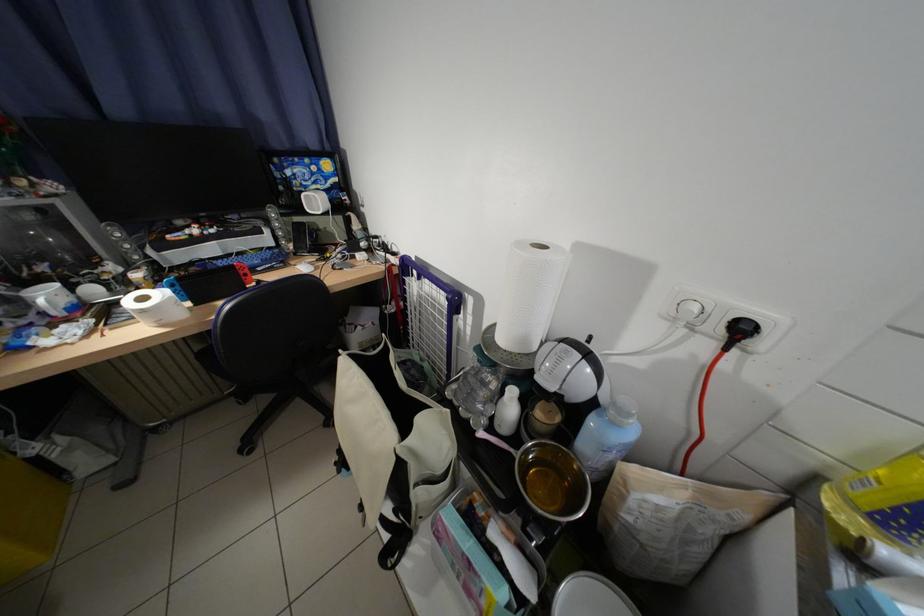
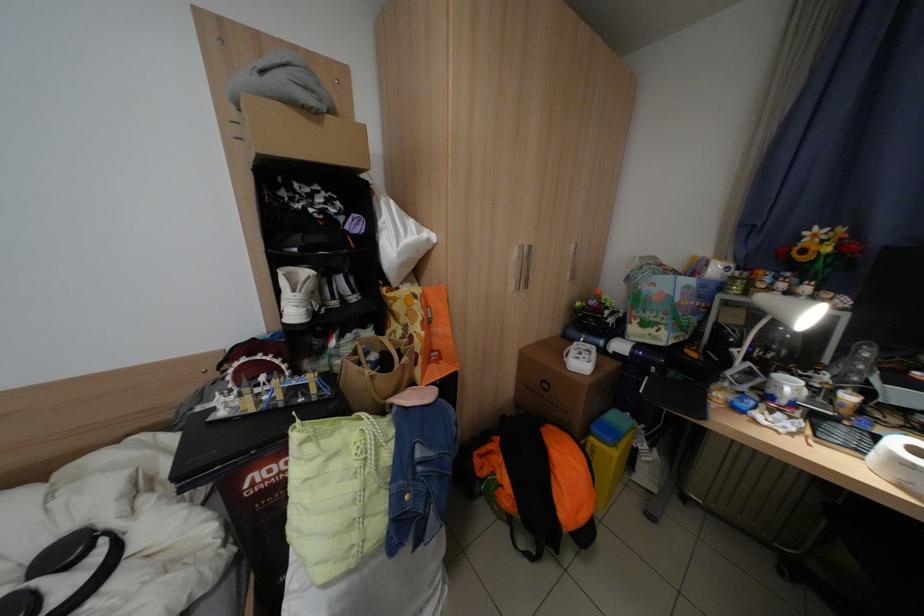
In the second image, find the point that corresponds to (x=59, y=297) in the first image.

(800, 387)